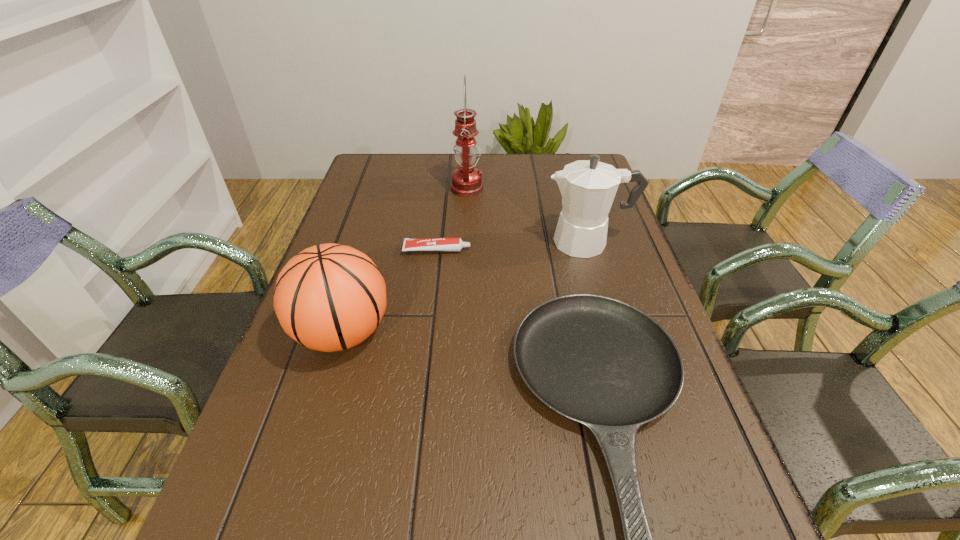
Where is `vacant space located at the nozzle of the toothpaste`? The height and width of the screenshot is (540, 960). vacant space located at the nozzle of the toothpaste is located at coordinates (519, 250).

Where is `object positioned at the far edge`? The height and width of the screenshot is (540, 960). object positioned at the far edge is located at coordinates (466, 180).

At what (x,y) coordinates should I click in order to perform the action: click on object at the left edge. Please return your answer as a coordinate pair (x, y). The image size is (960, 540). Looking at the image, I should click on (329, 297).

Identify the location of object present at the right edge. The height and width of the screenshot is (540, 960). (588, 187).

Where is `free space at the far edge of the desktop`? This screenshot has height=540, width=960. free space at the far edge of the desktop is located at coordinates (545, 177).

Find the location of a particular element. This screenshot has height=540, width=960. vacant area at the left edge is located at coordinates (351, 237).

The height and width of the screenshot is (540, 960). In the image, there is a desktop. In order to click on vacant space at the right edge in this screenshot , I will do `click(614, 285)`.

Find the location of a particular element. vacant space at the far left corner of the desktop is located at coordinates (377, 188).

The height and width of the screenshot is (540, 960). What are the coordinates of `blank region between the coffeepot and the toothpaste` in the screenshot? It's located at (513, 246).

I want to click on free area in between the oil lamp and the fourth shortest object, so click(527, 215).